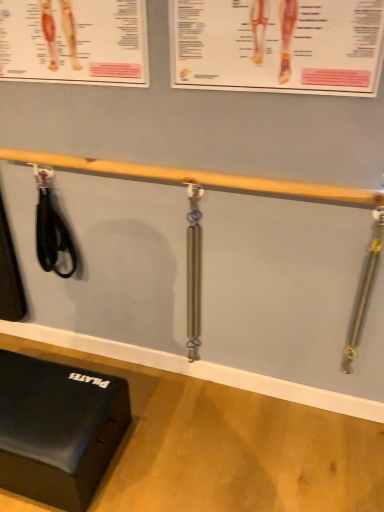
Question: Looking at their shapes, would you say silver metallic resistance band at center, the 2th tool positioned from the right, is wider or thinner than black rubber strap at left, which is the 3th tool from right to left?

Choices:
 (A) wide
 (B) thin

Answer: (A)

Question: From the image's perspective, is silver metallic resistance band at center, which is the 2th tool in left-to-right order, positioned above or below black rubber strap at left, marked as the 1th tool in a left-to-right arrangement?

Choices:
 (A) above
 (B) below

Answer: (B)

Question: Considering the real-world distances, which object is farthest from the silver metallic resistance band at right, the first tool positioned from the right?

Choices:
 (A) black rubber exercise mat at lower left
 (B) wooden beam at upper center
 (C) silver metallic resistance band at center, the 2th tool positioned from the right
 (D) black rubber strap at left, marked as the 1th tool in a left-to-right arrangement

Answer: (D)

Question: Which of these objects is positioned farthest from the silver metallic resistance band at right, the first tool positioned from the right?

Choices:
 (A) silver metallic resistance band at center, which is the 2th tool in left-to-right order
 (B) black rubber exercise mat at lower left
 (C) wooden beam at upper center
 (D) black rubber strap at left, marked as the 1th tool in a left-to-right arrangement

Answer: (D)